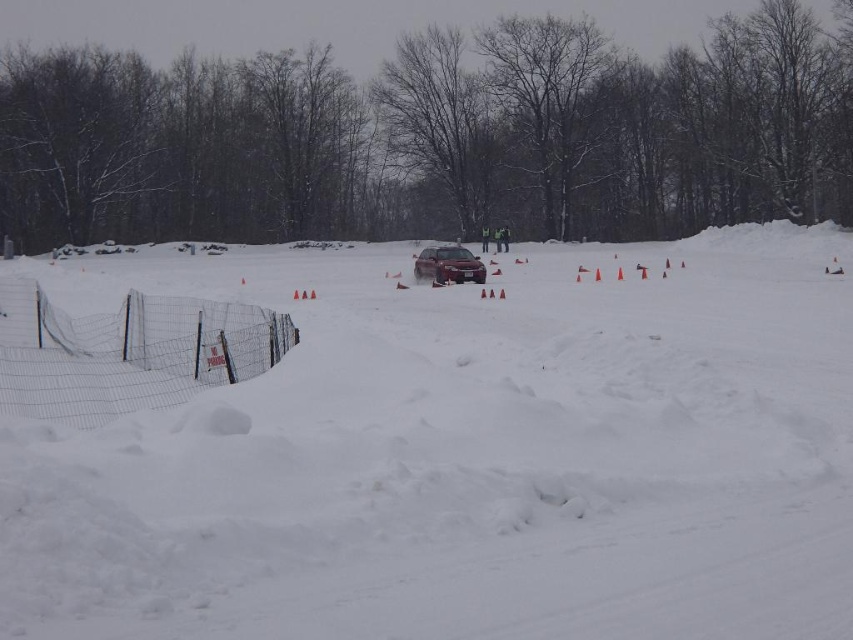
Question: Does wire mesh fence at lower left have a greater width compared to satin silver sedan at center?

Choices:
 (A) no
 (B) yes

Answer: (B)

Question: Which point appears closest to the camera in this image?

Choices:
 (A) (482, 276)
 (B) (160, 600)

Answer: (B)

Question: Among these points, which one is nearest to the camera?

Choices:
 (A) (434, 259)
 (B) (119, 536)

Answer: (B)

Question: Can you confirm if wire mesh fence at lower left is positioned to the left of satin silver sedan at center?

Choices:
 (A) no
 (B) yes

Answer: (B)

Question: Can you confirm if white fluffy snow at center is positioned above satin silver sedan at center?

Choices:
 (A) yes
 (B) no

Answer: (B)

Question: Among these points, which one is nearest to the camera?

Choices:
 (A) (459, 252)
 (B) (238, 374)

Answer: (B)